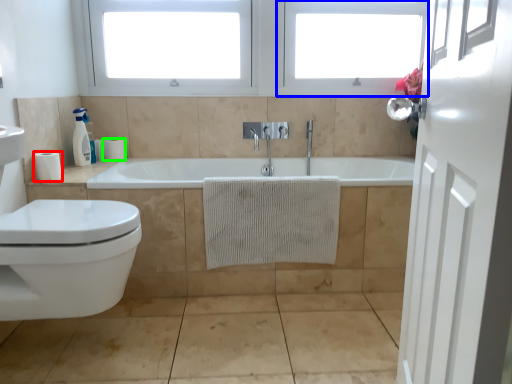
Question: Considering the real-world distances, which object is closest to toilet paper (highlighted by a red box)? window frame (highlighted by a blue box) or toilet paper (highlighted by a green box).

Choices:
 (A) window frame
 (B) toilet paper

Answer: (B)